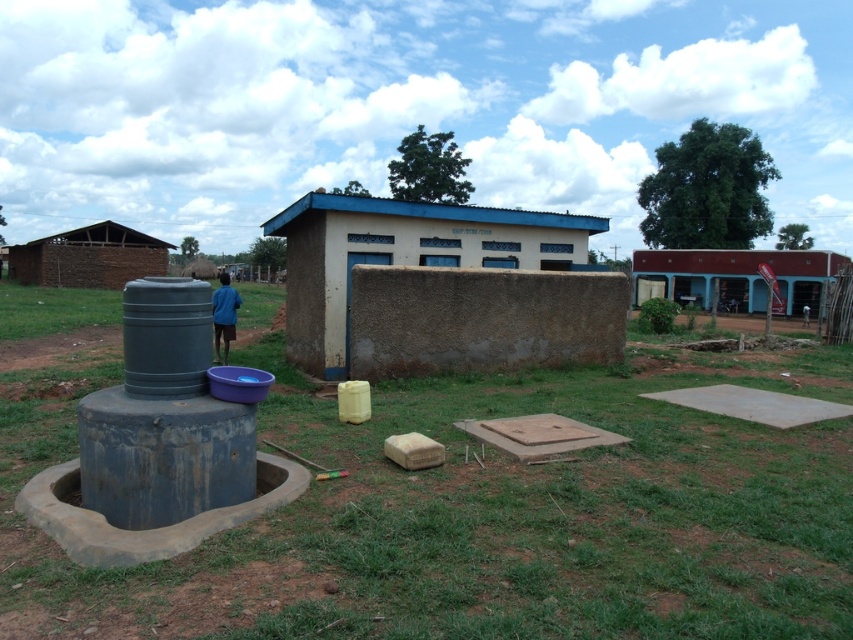
Which is below, brick wall building at right or blue fabric shirt at center?

Positioned lower is blue fabric shirt at center.

Is point (708, 298) behind point (213, 314)?

Yes, point (708, 298) is behind point (213, 314).

What are the coordinates of `brick wall building at right` in the screenshot? It's located at (738, 276).

Is brown mud hut at upper left positioned before blue fabric shirt at center?

No, brown mud hut at upper left is further to the viewer.

Which of these two, brown mud hut at upper left or blue fabric shirt at center, stands shorter?

brown mud hut at upper left is shorter.

I want to click on brown mud hut at upper left, so click(88, 257).

Is point (578, 225) positioned behind point (698, 269)?

No, it is in front of (698, 269).

Which is above, brown mud hut at center or brick wall building at right?

brick wall building at right is above.

Find the location of `brown mud hut at center`. brown mud hut at center is located at coordinates (402, 256).